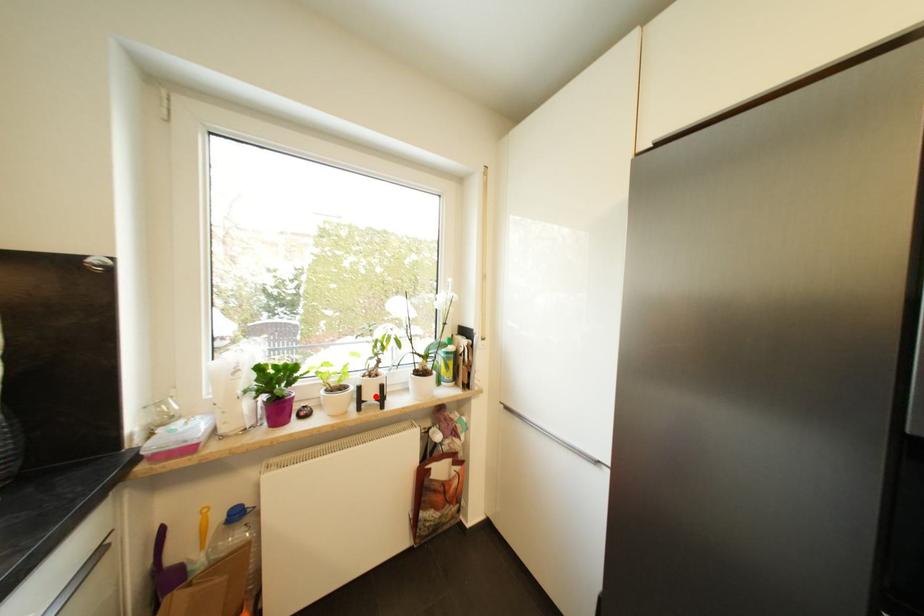
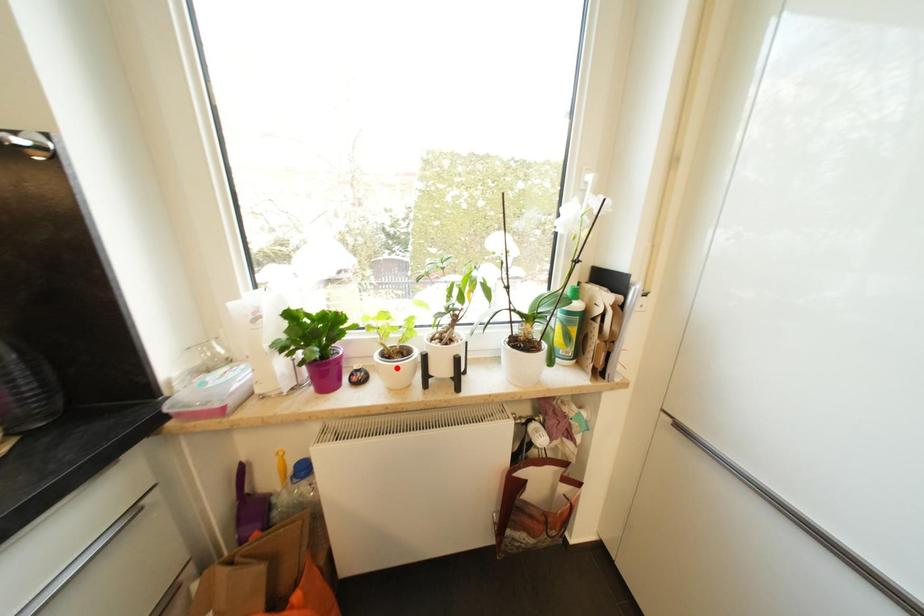
I am providing you with two images of the same scene from different viewpoints. A red point is marked on the first image and another point is marked on the second image. Do the highlighted points in image1 and image2 indicate the same real-world spot?

No